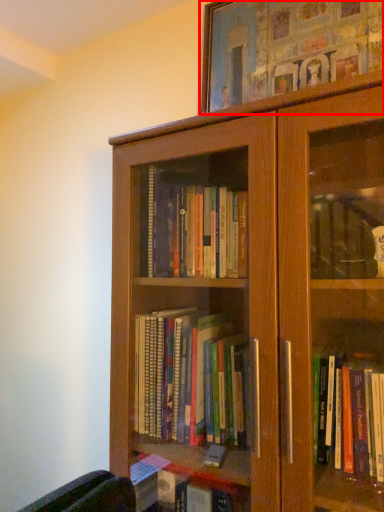
Question: From the image's perspective, what is the correct spatial relationship of picture frame (annotated by the red box) in relation to bookcase?

Choices:
 (A) above
 (B) below

Answer: (A)